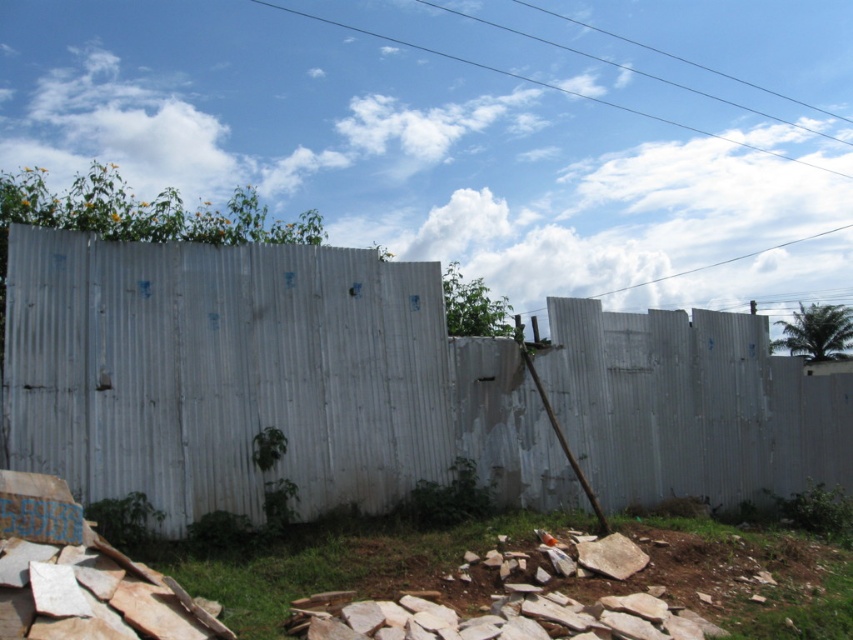
Question: Can you confirm if white corrugated metal fence at center is bigger than gray rough stone at lower center?

Choices:
 (A) yes
 (B) no

Answer: (A)

Question: Which object is closer to the camera taking this photo?

Choices:
 (A) gray rough stone at lower center
 (B) white corrugated metal fence at center

Answer: (A)

Question: Is the position of white corrugated metal fence at center more distant than that of gray rough stone at lower center?

Choices:
 (A) no
 (B) yes

Answer: (B)

Question: Which point is closer to the camera taking this photo?

Choices:
 (A) (585, 556)
 (B) (842, 461)

Answer: (A)

Question: Does white corrugated metal fence at center appear over gray rough stone at lower center?

Choices:
 (A) no
 (B) yes

Answer: (B)